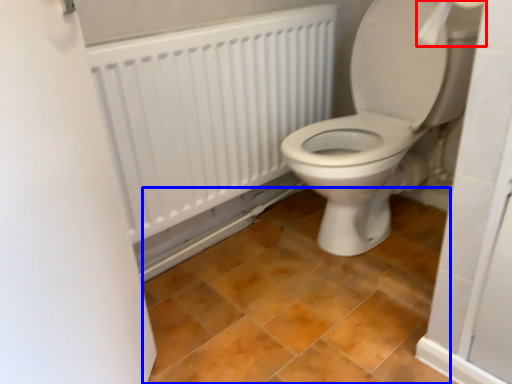
Question: Which point is closer to the camera, toilet paper (highlighted by a red box) or ceramic tile (highlighted by a blue box)?

Choices:
 (A) toilet paper
 (B) ceramic tile

Answer: (B)